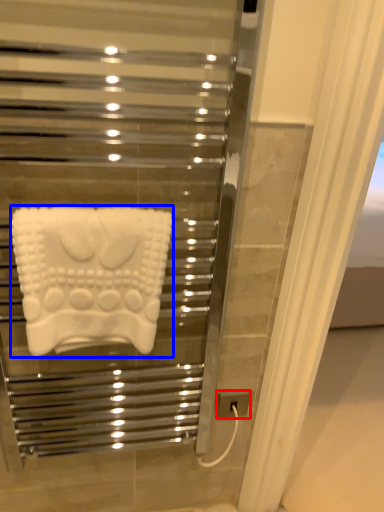
Question: Which of the following is the farthest to the observer, electric outlet (highlighted by a red box) or towel (highlighted by a blue box)?

Choices:
 (A) electric outlet
 (B) towel

Answer: (A)